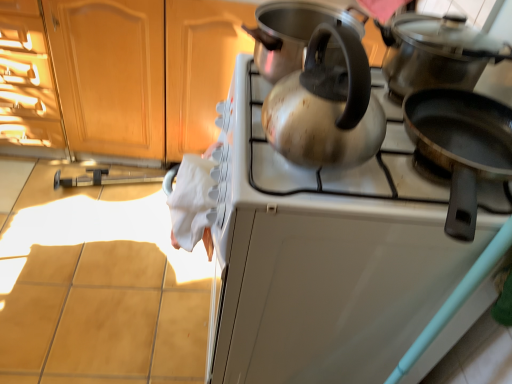
What do you see at coordinates (292, 33) in the screenshot? This screenshot has height=384, width=512. I see `shiny metallic kettle at upper center, placed as the 2th kitchen appliance when sorted from bottom to top` at bounding box center [292, 33].

This screenshot has height=384, width=512. Describe the element at coordinates (329, 252) in the screenshot. I see `satin silver kettle at upper center` at that location.

The image size is (512, 384). Describe the element at coordinates (326, 107) in the screenshot. I see `satin silver kettle at center` at that location.

Describe the element at coordinates (436, 52) in the screenshot. The image size is (512, 384). I see `shiny black pot at upper right, the third kitchen appliance positioned from the bottom` at that location.

I want to click on shiny metallic kettle at upper center, arranged as the 2th kitchen appliance when viewed from the top, so click(292, 33).

Are satin silver kettle at upper center and shiny metallic kettle at upper center, arranged as the 2th kitchen appliance when viewed from the top, beside each other?

There is a gap between satin silver kettle at upper center and shiny metallic kettle at upper center, arranged as the 2th kitchen appliance when viewed from the top.

Considering the relative sizes of satin silver kettle at upper center and shiny metallic kettle at upper center, arranged as the 2th kitchen appliance when viewed from the top, in the image provided, is satin silver kettle at upper center smaller than shiny metallic kettle at upper center, arranged as the 2th kitchen appliance when viewed from the top,?

Incorrect, satin silver kettle at upper center is not smaller in size than shiny metallic kettle at upper center, arranged as the 2th kitchen appliance when viewed from the top.

Considering the positions of objects satin silver kettle at upper center and shiny metallic kettle at upper center, arranged as the 2th kitchen appliance when viewed from the top, in the image provided, who is more to the right, satin silver kettle at upper center or shiny metallic kettle at upper center, arranged as the 2th kitchen appliance when viewed from the top,?

From the viewer's perspective, satin silver kettle at upper center appears more on the right side.

Considering the sizes of objects satin silver kettle at upper center and shiny metallic kettle at upper center, arranged as the 2th kitchen appliance when viewed from the top, in the image provided, who is wider, satin silver kettle at upper center or shiny metallic kettle at upper center, arranged as the 2th kitchen appliance when viewed from the top,?

satin silver kettle at upper center.

From a real-world perspective, is satin silver kettle at center above or below satin silver kettle at upper center?

From a real-world perspective, satin silver kettle at center is physically above satin silver kettle at upper center.

Is satin silver kettle at center placed right next to satin silver kettle at upper center?

They are not placed beside each other.

Is satin silver kettle at center aimed at satin silver kettle at upper center?

No, satin silver kettle at center is not facing towards satin silver kettle at upper center.

Can you confirm if satin silver kettle at upper center is shorter than shiny black pot at upper right, the third kitchen appliance positioned from the bottom?

Incorrect, the height of satin silver kettle at upper center does not fall short of that of shiny black pot at upper right, the third kitchen appliance positioned from the bottom.

Does satin silver kettle at upper center have a lesser width compared to shiny black pot at upper right, which appears as the first kitchen appliance when viewed from the top?

Incorrect, the width of satin silver kettle at upper center is not less than that of shiny black pot at upper right, which appears as the first kitchen appliance when viewed from the top.

Can shiny black pot at upper right, which appears as the first kitchen appliance when viewed from the top, be found inside satin silver kettle at upper center?

No.

From the image's perspective, is satin silver kettle at upper center below shiny black pot at upper right, the third kitchen appliance positioned from the bottom?

Correct, satin silver kettle at upper center appears lower than shiny black pot at upper right, the third kitchen appliance positioned from the bottom, in the image.

Which object is more forward, black non-stick frying pan at right, which is counted as the 1th kitchen appliance, starting from the bottom, or shiny black pot at upper right, which appears as the first kitchen appliance when viewed from the top?

Positioned in front is black non-stick frying pan at right, which is counted as the 1th kitchen appliance, starting from the bottom.

Could shiny black pot at upper right, the third kitchen appliance positioned from the bottom, be considered to be inside black non-stick frying pan at right, which is counted as the 1th kitchen appliance, starting from the bottom?

No.

Is black non-stick frying pan at right, which is counted as the 1th kitchen appliance, starting from the bottom, wider or thinner than shiny black pot at upper right, which appears as the first kitchen appliance when viewed from the top?

In the image, black non-stick frying pan at right, which is counted as the 1th kitchen appliance, starting from the bottom, appears to be more narrow than shiny black pot at upper right, which appears as the first kitchen appliance when viewed from the top.

Which is more to the right, black non-stick frying pan at right, which is counted as the 1th kitchen appliance, starting from the bottom, or shiny black pot at upper right, the third kitchen appliance positioned from the bottom?

black non-stick frying pan at right, which is counted as the 1th kitchen appliance, starting from the bottom, is more to the right.

Is the surface of satin silver kettle at center in direct contact with wooden cabinet at upper left?

satin silver kettle at center and wooden cabinet at upper left are not in contact.

Is satin silver kettle at center to the left or to the right of wooden cabinet at upper left in the image?

satin silver kettle at center is positioned on wooden cabinet at upper left's right side.

How different are the orientations of satin silver kettle at center and wooden cabinet at upper left in degrees?

The angle between the facing direction of satin silver kettle at center and the facing direction of wooden cabinet at upper left is 92.8 degrees.

Could wooden cabinet at upper left be considered to be inside satin silver kettle at center?

Definitely not — wooden cabinet at upper left is not inside satin silver kettle at center.

This screenshot has height=384, width=512. I want to click on kitchen appliance on the left of satin silver kettle at upper center, so click(x=292, y=33).

Does shiny metallic kettle at upper center, placed as the 2th kitchen appliance when sorted from bottom to top, have a greater width compared to satin silver kettle at upper center?

Incorrect, the width of shiny metallic kettle at upper center, placed as the 2th kitchen appliance when sorted from bottom to top, does not surpass that of satin silver kettle at upper center.

Are shiny metallic kettle at upper center, arranged as the 2th kitchen appliance when viewed from the top, and satin silver kettle at upper center far apart?

shiny metallic kettle at upper center, arranged as the 2th kitchen appliance when viewed from the top, is actually quite close to satin silver kettle at upper center.

From a real-world perspective, is shiny metallic kettle at upper center, arranged as the 2th kitchen appliance when viewed from the top, physically located above or below satin silver kettle at upper center?

In terms of real-world spatial position, shiny metallic kettle at upper center, arranged as the 2th kitchen appliance when viewed from the top, is above satin silver kettle at upper center.

Considering the sizes of objects shiny black pot at upper right, which appears as the first kitchen appliance when viewed from the top, and satin silver kettle at center in the image provided, who is thinner, shiny black pot at upper right, which appears as the first kitchen appliance when viewed from the top, or satin silver kettle at center?

satin silver kettle at center.

Are shiny black pot at upper right, which appears as the first kitchen appliance when viewed from the top, and satin silver kettle at center located far from each other?

No, there isn't a large distance between shiny black pot at upper right, which appears as the first kitchen appliance when viewed from the top, and satin silver kettle at center.

At what (x,y) coordinates should I click in order to perform the action: click on oven below the shiny metallic kettle at upper center, placed as the 2th kitchen appliance when sorted from bottom to top (from a real-world perspective). Please return your answer as a coordinate pair (x, y). Image resolution: width=512 pixels, height=384 pixels. Looking at the image, I should click on (329, 252).

There is a satin silver kettle at upper center. Where is `kettle above it (from a real-world perspective)`? kettle above it (from a real-world perspective) is located at coordinates (326, 107).

Considering their positions, is satin silver kettle at center positioned further to shiny black pot at upper right, which appears as the first kitchen appliance when viewed from the top, than satin silver kettle at upper center?

The object further to shiny black pot at upper right, which appears as the first kitchen appliance when viewed from the top, is satin silver kettle at upper center.

Looking at the image, which one is located further to shiny metallic kettle at upper center, placed as the 2th kitchen appliance when sorted from bottom to top, wooden cabinet at upper left or satin silver kettle at upper center?

wooden cabinet at upper left.

Consider the image. Based on their spatial positions, is shiny black pot at upper right, which appears as the first kitchen appliance when viewed from the top, or satin silver kettle at upper center closer to satin silver kettle at center?

Based on the image, satin silver kettle at upper center appears to be nearer to satin silver kettle at center.

When comparing their distances from satin silver kettle at center, does satin silver kettle at upper center or shiny black pot at upper right, which appears as the first kitchen appliance when viewed from the top, seem further?

shiny black pot at upper right, which appears as the first kitchen appliance when viewed from the top.

Which object lies nearer to the anchor point black non-stick frying pan at right, which is counted as the 1th kitchen appliance, starting from the bottom, shiny black pot at upper right, the third kitchen appliance positioned from the bottom, or wooden cabinet at upper left?

Based on the image, shiny black pot at upper right, the third kitchen appliance positioned from the bottom, appears to be nearer to black non-stick frying pan at right, which is counted as the 1th kitchen appliance, starting from the bottom.

Based on the photo, which object lies nearer to the anchor point shiny black pot at upper right, which appears as the first kitchen appliance when viewed from the top, shiny metallic kettle at upper center, placed as the 2th kitchen appliance when sorted from bottom to top, or satin silver kettle at upper center?

Based on the image, shiny metallic kettle at upper center, placed as the 2th kitchen appliance when sorted from bottom to top, appears to be nearer to shiny black pot at upper right, which appears as the first kitchen appliance when viewed from the top.

When comparing their distances from black non-stick frying pan at right, the third kitchen appliance positioned from the top, does shiny metallic kettle at upper center, arranged as the 2th kitchen appliance when viewed from the top, or wooden cabinet at upper left seem closer?

The object closer to black non-stick frying pan at right, the third kitchen appliance positioned from the top, is shiny metallic kettle at upper center, arranged as the 2th kitchen appliance when viewed from the top.

Looking at the image, which one is located further to shiny black pot at upper right, the third kitchen appliance positioned from the bottom, wooden cabinet at upper left or shiny metallic kettle at upper center, arranged as the 2th kitchen appliance when viewed from the top?

wooden cabinet at upper left is positioned further to the anchor shiny black pot at upper right, the third kitchen appliance positioned from the bottom.

The image size is (512, 384). Find the location of `kitchen appliance between wooden cabinet at upper left and shiny black pot at upper right, which appears as the first kitchen appliance when viewed from the top, in the horizontal direction`. kitchen appliance between wooden cabinet at upper left and shiny black pot at upper right, which appears as the first kitchen appliance when viewed from the top, in the horizontal direction is located at coordinates (292, 33).

The height and width of the screenshot is (384, 512). Identify the location of kettle located between wooden cabinet at upper left and shiny black pot at upper right, which appears as the first kitchen appliance when viewed from the top, in the left-right direction. (326, 107).

Identify the location of kitchen appliance between shiny metallic kettle at upper center, placed as the 2th kitchen appliance when sorted from bottom to top, and black non-stick frying pan at right, which is counted as the 1th kitchen appliance, starting from the bottom, in the horizontal direction. (436, 52).

Identify the location of kettle located between black non-stick frying pan at right, which is counted as the 1th kitchen appliance, starting from the bottom, and wooden cabinet at upper left in the depth direction. This screenshot has height=384, width=512. (326, 107).